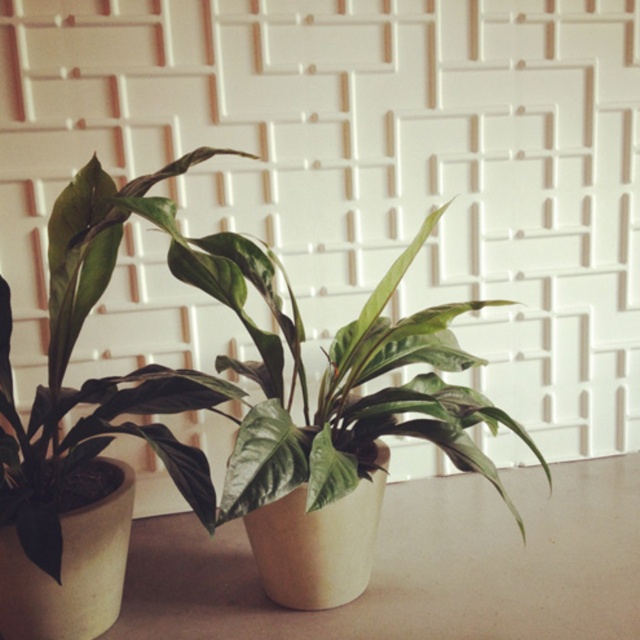
Which of these two, beige matte table at center or green matte leafy plant at left, stands shorter?

Standing shorter between the two is beige matte table at center.

Is beige matte table at center shorter than green matte leafy plant at left?

Indeed, beige matte table at center has a lesser height compared to green matte leafy plant at left.

The height and width of the screenshot is (640, 640). Identify the location of beige matte table at center. (419, 566).

What are the coordinates of `beige matte table at center` in the screenshot? It's located at click(419, 566).

Is point (476, 540) positioned after point (198, 253)?

That is True.

Does point (378, 618) come closer to viewer compared to point (356, 451)?

Yes, it is in front of point (356, 451).

Describe the element at coordinates (419, 566) in the screenshot. This screenshot has width=640, height=640. I see `beige matte table at center` at that location.

Find the location of a particular element. The image size is (640, 640). beige matte table at center is located at coordinates (419, 566).

Does green matte leafy plant at center appear on the right side of green matte leafy plant at left?

Indeed, green matte leafy plant at center is positioned on the right side of green matte leafy plant at left.

Who is higher up, green matte leafy plant at center or green matte leafy plant at left?

green matte leafy plant at left is above.

Is point (289, 342) positioned after point (198, 156)?

Yes, point (289, 342) is behind point (198, 156).

Find the location of `green matte leafy plant at center`. green matte leafy plant at center is located at coordinates pos(340,385).